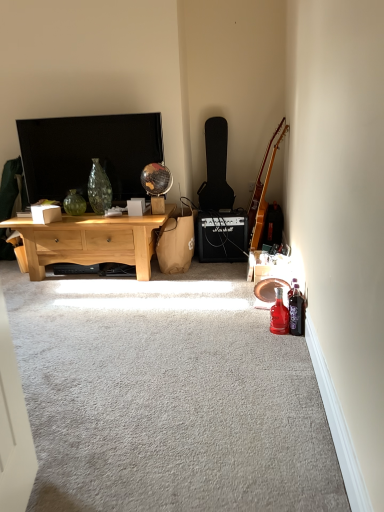
This screenshot has width=384, height=512. Find the location of `vacant area that is in front of black matte amplifier at center`. vacant area that is in front of black matte amplifier at center is located at coordinates (226, 267).